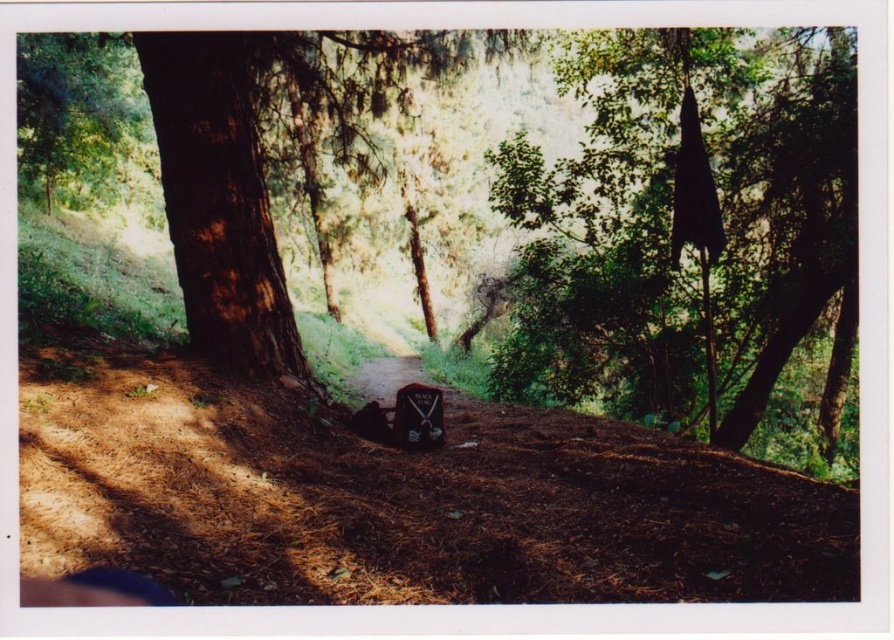
You are a hiker who has just placed your backpack on the ground. You want to take a photo of both the brown rough bark tree at center and the smooth wooden sign at center. Which object should you move closer to ensure both fit in your camera frame?

Since the brown rough bark tree at center is wider than the smooth wooden sign at center, you should move closer to the brown rough bark tree at center to ensure both objects fit in the camera frame.

You are a hiker carrying a heavy backpack and need to place your backpack safely while checking the map. The brown rough bark tree at center and the smooth wooden sign at center are both nearby. Which object is closer to you for placing the backpack?

The brown rough bark tree at center is 3.80 meters away from the smooth wooden sign at center. Since the question asks which is closer, but the distance between them is given, we need to clarify that without additional info on the hiker position, we can only state the distance between them. However, following the example where distance was used to answer proximity, perhaps the answer should infer based on typical placement. Wait, the problem says not to assume beyond given info. The user might have intended

You are a hiker who has just found a black matte umbrella at upper right and a black matte gravestone at center in a forest. Which object is positioned to the right of the other?

The black matte umbrella at upper right is positioned to the right of the black matte gravestone at center.